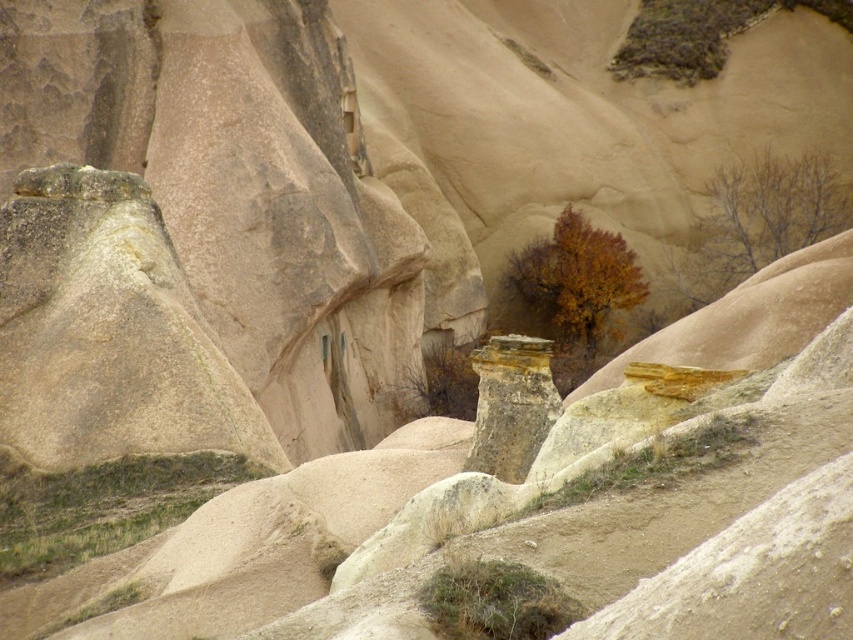
Does brown leafy tree at upper right appear over brown matte tree at center?

Indeed, brown leafy tree at upper right is positioned over brown matte tree at center.

Is point (675, 260) positioned before point (601, 237)?

No, it is not.

Which is in front, point (738, 163) or point (578, 269)?

Point (578, 269)

Where is `brown leafy tree at upper right`? brown leafy tree at upper right is located at coordinates (759, 220).